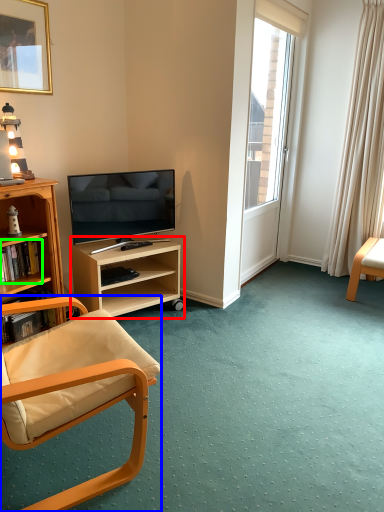
Question: Which object is positioned farthest from shelf (highlighted by a red box)? Select from chair (highlighted by a blue box) and book (highlighted by a green box).

Choices:
 (A) chair
 (B) book

Answer: (A)